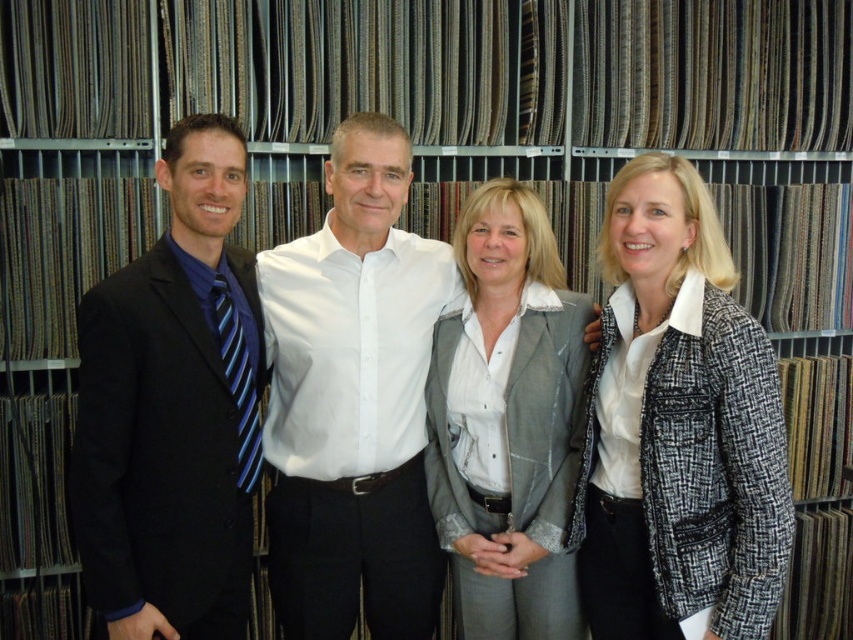
Question: Which point is farther from the camera taking this photo?

Choices:
 (A) (483, 262)
 (B) (735, 356)
 (C) (183, 420)
 (D) (256, 484)

Answer: (A)

Question: Can you confirm if matte black suit at left is positioned to the right of white cotton shirt at center?

Choices:
 (A) no
 (B) yes

Answer: (A)

Question: Is gray fabric suit at center above blue striped tie at left?

Choices:
 (A) no
 (B) yes

Answer: (A)

Question: Which point is closer to the camera?

Choices:
 (A) matte black suit at left
 (B) gray fabric suit at center
 (C) white cotton shirt at center

Answer: (A)

Question: Can you confirm if black tweed blazer at center is positioned to the left of blue striped tie at left?

Choices:
 (A) no
 (B) yes

Answer: (A)

Question: Based on their relative distances, which object is farther from the gray fabric suit at center?

Choices:
 (A) blue striped tie at left
 (B) black tweed blazer at center
 (C) matte black suit at left

Answer: (C)